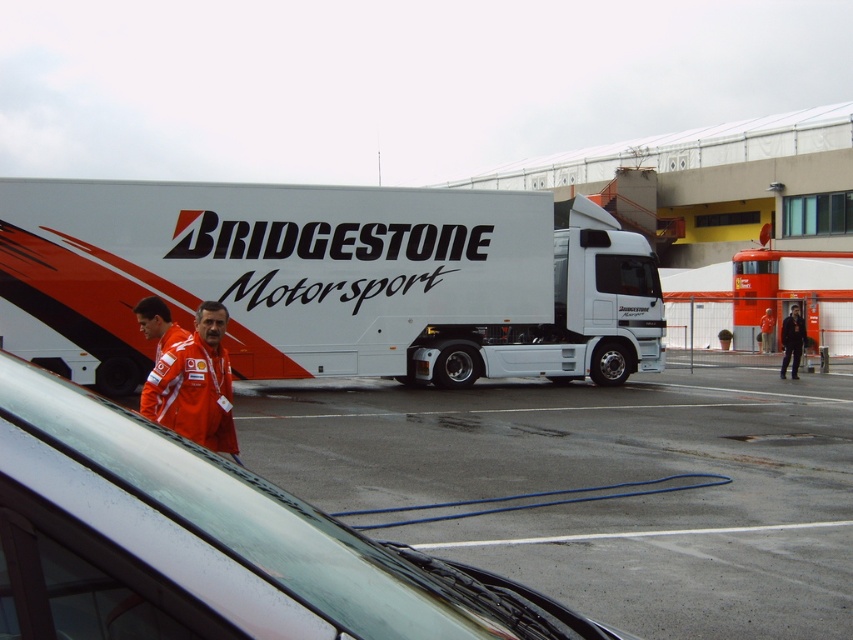
Is white glossy truck at center positioned in front of orange fabric jacket at center?

Yes, white glossy truck at center is closer to the viewer.

From the picture: Can you confirm if white glossy truck at center is thinner than orange fabric jacket at center?

In fact, white glossy truck at center might be wider than orange fabric jacket at center.

Which is in front, point (125, 308) or point (766, 324)?

Point (125, 308)

The height and width of the screenshot is (640, 853). Identify the location of white glossy truck at center. (321, 280).

Is orange fabric jacket at lower center shorter than orange fabric jacket at center?

Correct, orange fabric jacket at lower center is not as tall as orange fabric jacket at center.

Does orange fabric jacket at lower center have a smaller size compared to orange fabric jacket at center?

Actually, orange fabric jacket at lower center might be larger than orange fabric jacket at center.

Which is in front, point (183, 365) or point (767, 308)?

Positioned in front is point (183, 365).

At what (x,y) coordinates should I click in order to perform the action: click on orange fabric jacket at lower center. Please return your answer as a coordinate pair (x, y). The height and width of the screenshot is (640, 853). Looking at the image, I should click on (195, 385).

Which is in front, point (306, 563) or point (767, 320)?

Positioned in front is point (306, 563).

Which is below, metallic silver car at center or orange fabric jacket at center?

orange fabric jacket at center

Locate an element on the screen. The width and height of the screenshot is (853, 640). metallic silver car at center is located at coordinates (279, 528).